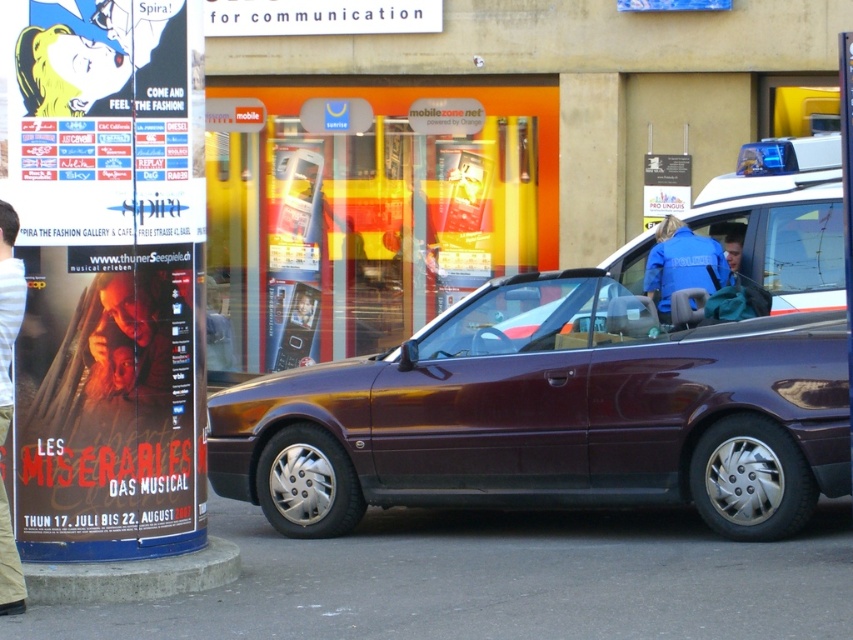
Based on the provided scene description, what are the coordinates of the satin burgundy convertible at center?

The satin burgundy convertible at center is located at coordinates point (550, 413).

You are a delivery person trying to park your van next to the satin burgundy convertible at center. The van requires a space wider than the light beige pants at left. Can you park your van here?

The satin burgundy convertible at center is wider than the light beige pants at left. Since the van needs a space wider than the light beige pants at left, the space next to the satin burgundy convertible at center is sufficient for parking the van.